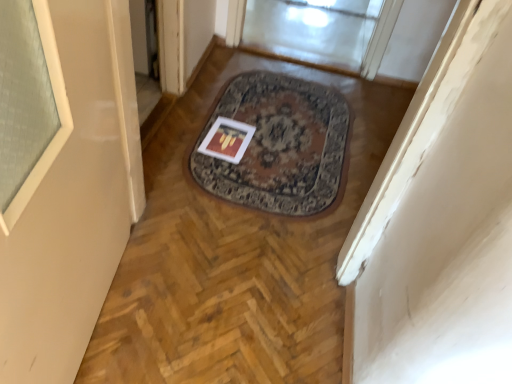
The image size is (512, 384). In order to click on blank space to the left of matte paper postcard at center in this screenshot , I will do `click(184, 132)`.